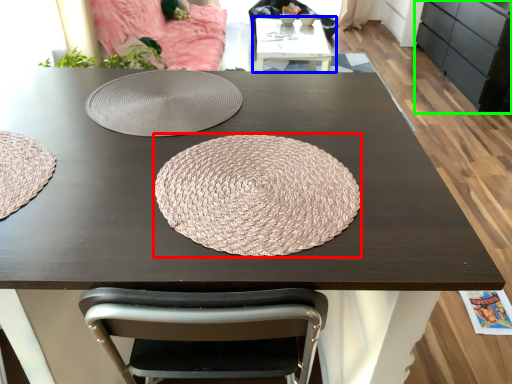
Question: Which object is positioned farthest from mat (highlighted by a red box)? Select from table (highlighted by a blue box) and cabinetry (highlighted by a green box).

Choices:
 (A) table
 (B) cabinetry

Answer: (B)